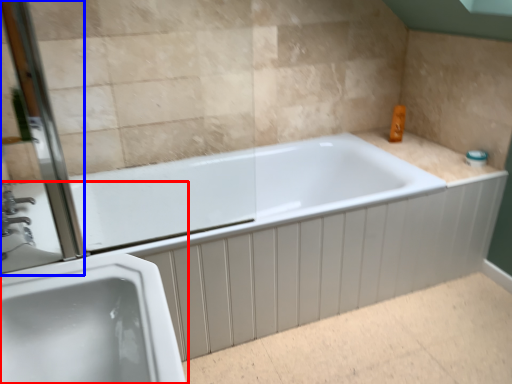
Question: Among these objects, which one is farthest to the camera, sink (highlighted by a red box) or screen door (highlighted by a blue box)?

Choices:
 (A) sink
 (B) screen door

Answer: (B)